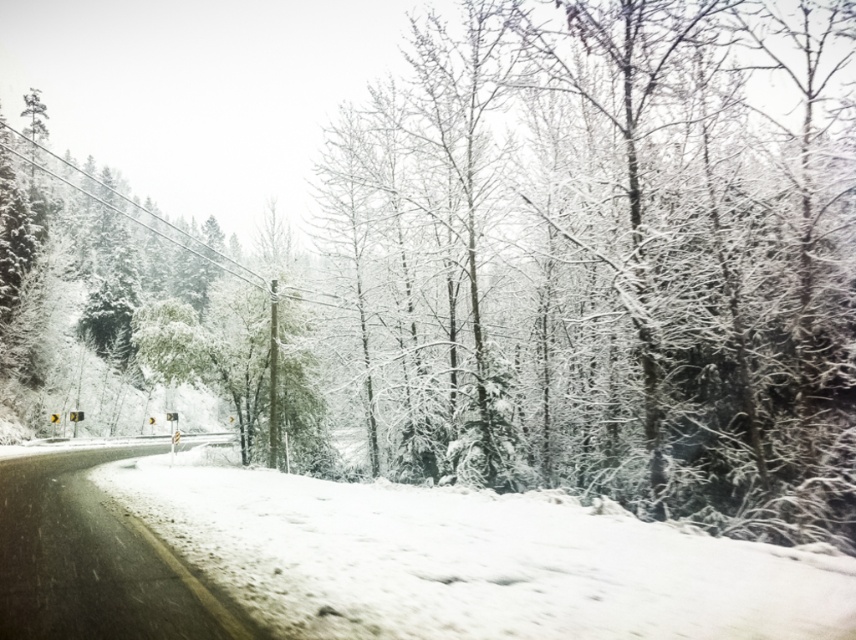
You are planning to build a snowman using the white fluffy snow at center and the snowy asphalt road at lower left. Which area has enough width to accommodate the base of the snowman?

The white fluffy snow at center might be wider than the snowy asphalt road at lower left, so it has enough width to accommodate the base of the snowman.

You are a hiker trying to walk along the snowy asphalt road at lower left. There is white fluffy snow at center in the image. Which surface should you avoid stepping on to stay on the road?

You should avoid stepping on the white fluffy snow at center because it is located above the snowy asphalt road at lower left, meaning it might be a snowdrift or accumulation that could be unstable or off the path.